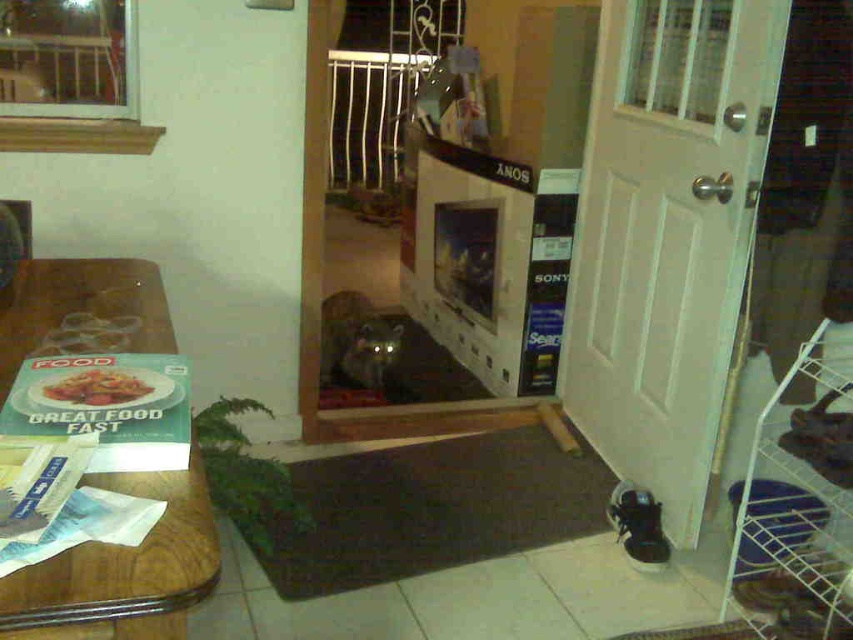
Question: Can you confirm if white wood door at right is positioned below wooden table at left?

Choices:
 (A) yes
 (B) no

Answer: (B)

Question: Which object is closer to the camera taking this photo?

Choices:
 (A) white wood door at right
 (B) matte paper book at left
 (C) wooden table at left

Answer: (B)

Question: Which of these objects is positioned farthest from the matte paper book at left?

Choices:
 (A) white wood door at right
 (B) wooden table at left

Answer: (A)

Question: Does white wood door at right appear over matte paper book at left?

Choices:
 (A) yes
 (B) no

Answer: (A)

Question: Which object appears closest to the camera in this image?

Choices:
 (A) wooden table at left
 (B) matte paper book at left
 (C) white wood door at right

Answer: (B)

Question: Can you confirm if white wood door at right is positioned below matte paper book at left?

Choices:
 (A) no
 (B) yes

Answer: (A)